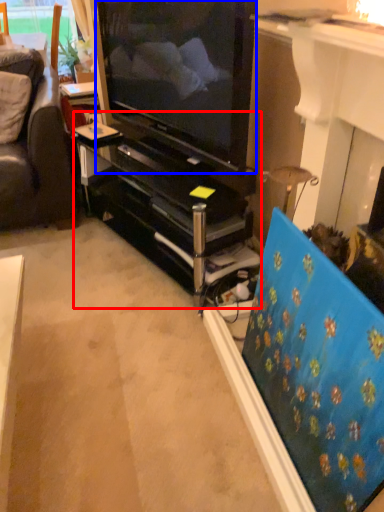
Question: Among these objects, which one is farthest to the camera, tv cabinet (highlighted by a red box) or television (highlighted by a blue box)?

Choices:
 (A) tv cabinet
 (B) television

Answer: (A)